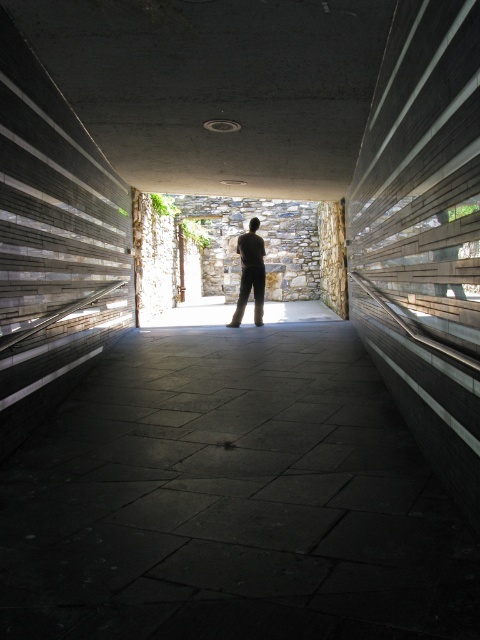
Question: Does dark stone pavement at center appear under stone wall at center?

Choices:
 (A) no
 (B) yes

Answer: (B)

Question: Among these objects, which one is nearest to the camera?

Choices:
 (A) dark stone pavement at center
 (B) stone wall at center
 (C) dark brown pants at center

Answer: (A)

Question: Can you confirm if dark stone pavement at center is positioned to the right of stone wall at center?

Choices:
 (A) no
 (B) yes

Answer: (A)

Question: Which of the following is the farthest from the observer?

Choices:
 (A) dark stone pavement at center
 (B) dark brown pants at center

Answer: (B)

Question: Which of the following is the farthest from the observer?

Choices:
 (A) (359, 557)
 (B) (251, 236)
 (C) (211, 246)

Answer: (C)

Question: Can you confirm if dark stone pavement at center is positioned to the right of stone wall at center?

Choices:
 (A) no
 (B) yes

Answer: (A)